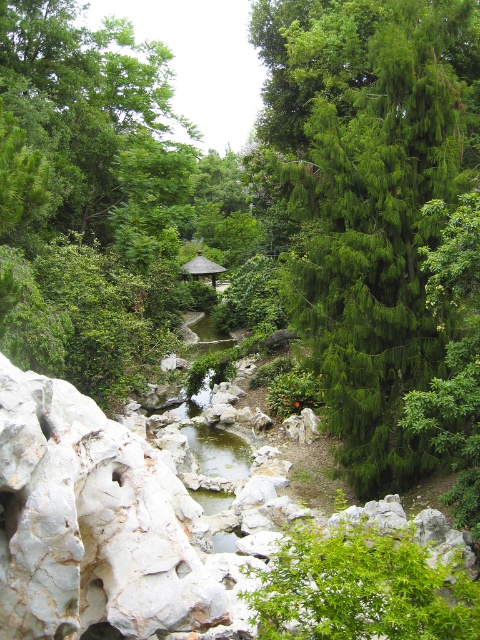
You are standing at the point marked by the coordinates (369, 196) in the garden. Looking around, you see a rugged white rock formation in the foreground and a small stream in the midground. Which direction should you walk to reach the stream from your current position?

The point at (369, 196) is the green needle like tree at center right. The stream is in the midground, so to reach it from the tree, you should walk towards the center of the garden where the stream is located.